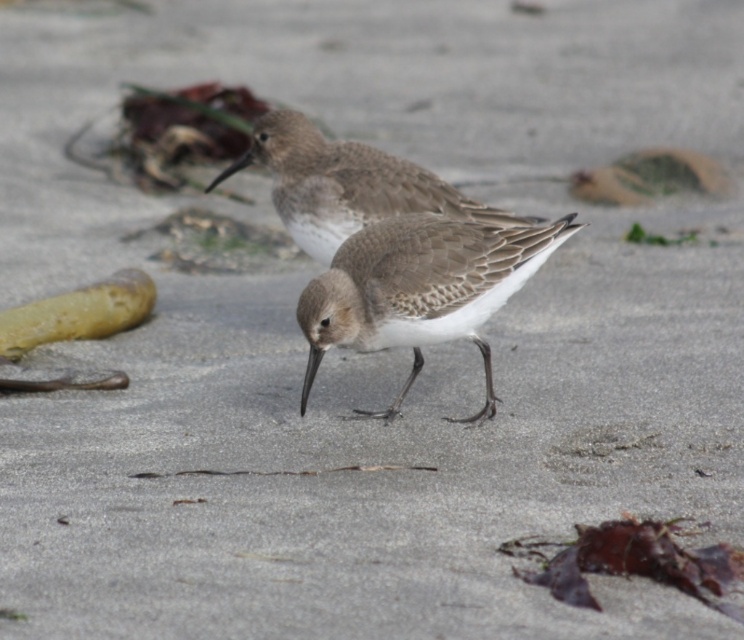
You are a wildlife photographer aiming to capture a closeup shot of the brown speckled sandpiper at center. Given that your camera lens has a minimum focusing distance of 2 meters, will you be able to take the photo without moving closer?

The brown speckled sandpiper at center is 2.33 meters away from the viewer. Since the minimum focusing distance is 2 meters, you can take the closeup shot without moving closer because the distance is within the camera lens capability.

Where is the brown speckled sandpiper at center located in the image?

The brown speckled sandpiper at center is located at point coordinates of (420, 289).

You are a birdwatcher observing two dunlin birds on a beach. You notice a point marked at coordinates [420,289]. Which bird does this point correspond to?

The point at coordinates [420,289] corresponds to the brown speckled sandpiper at center.